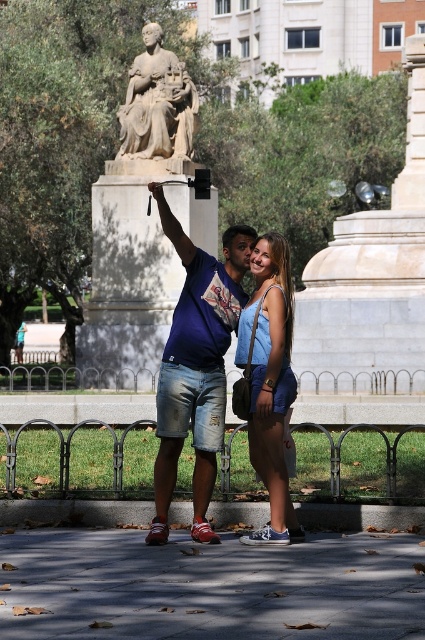
You are standing in the park and see two points marked in the scene. Which point is closer to you, point (223, 404) or point (169, 64)?

Point (223, 404) is closer to the viewer than point (169, 64).